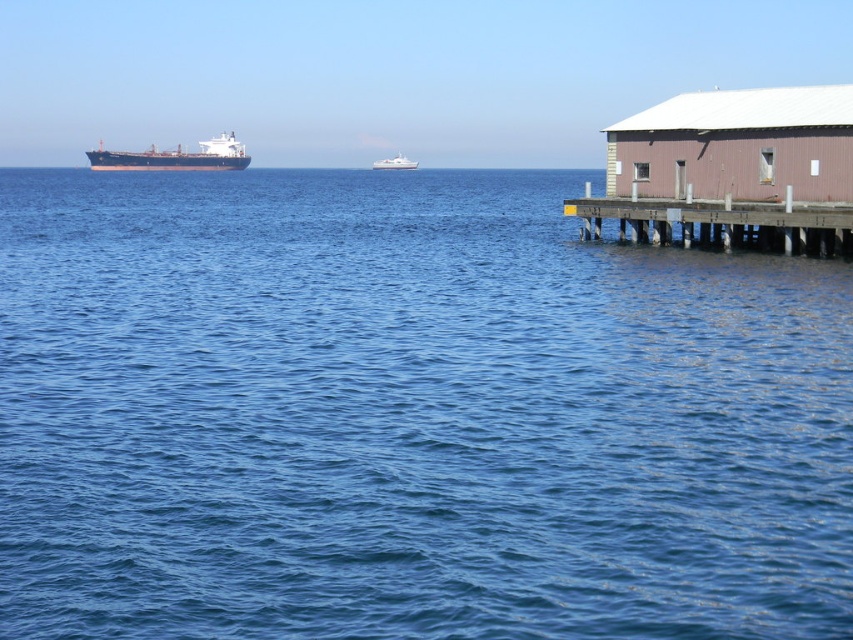
Does pink wood hut at right appear on the left side of brown wooden dock at right?

No, pink wood hut at right is not to the left of brown wooden dock at right.

Does pink wood hut at right have a lesser width compared to brown wooden dock at right?

In fact, pink wood hut at right might be wider than brown wooden dock at right.

Does point (798, 196) lie in front of point (666, 205)?

That is True.

Find the location of `pink wood hut at right`. pink wood hut at right is located at coordinates (737, 145).

Between blue water at center and matte black ship at left, which one appears on the left side from the viewer's perspective?

From the viewer's perspective, matte black ship at left appears more on the left side.

In the scene shown: Between blue water at center and matte black ship at left, which one is positioned higher?

matte black ship at left is higher up.

Between point (141, 493) and point (229, 138), which one is positioned behind?

The point (229, 138) is more distant.

Image resolution: width=853 pixels, height=640 pixels. I want to click on blue water at center, so click(407, 416).

Who is higher up, blue water at center or pink wood hut at right?

pink wood hut at right

Find the location of a particular element. Image resolution: width=853 pixels, height=640 pixels. blue water at center is located at coordinates (407, 416).